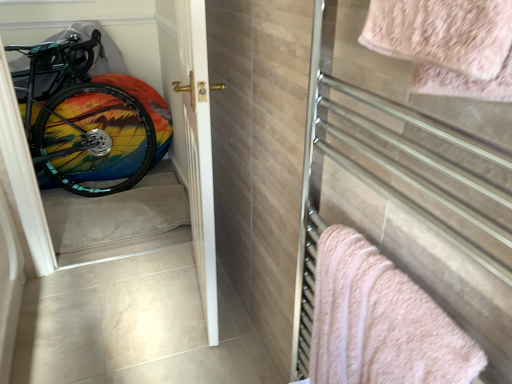
You are a GUI agent. You are given a task and a screenshot of the screen. Output one action in this format:
    pyautogui.click(x=<x>, y=<y>)
    Task: Click on the free space above carpeted stairwell at left (from a real-world perspective)
    Image resolution: width=512 pixels, height=384 pixels.
    Given the screenshot: What is the action you would take?
    coord(113,218)